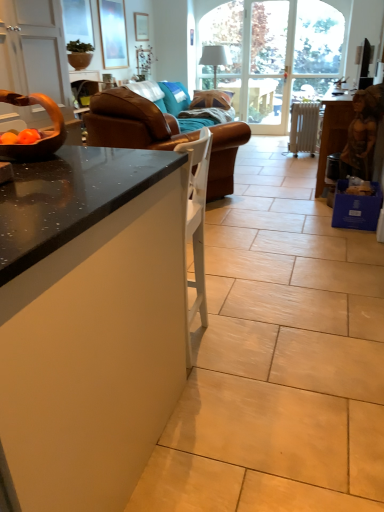
What are the coordinates of `free space to the right of brown leather bowl at left` in the screenshot? It's located at (108, 156).